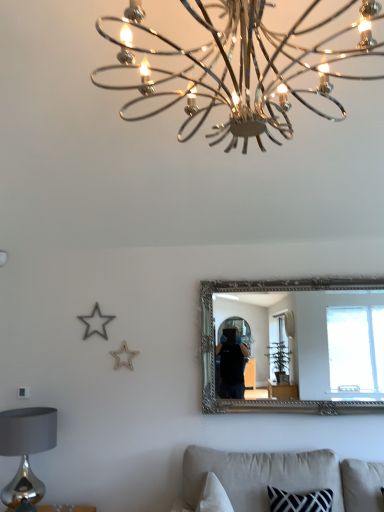
Question: Does silver ornate mirror at center touch shiny silver table lamp at lower left?

Choices:
 (A) yes
 (B) no

Answer: (B)

Question: Is silver ornate mirror at center bigger than shiny silver table lamp at lower left?

Choices:
 (A) no
 (B) yes

Answer: (B)

Question: From the image's perspective, is silver ornate mirror at center above shiny silver table lamp at lower left?

Choices:
 (A) no
 (B) yes

Answer: (B)

Question: Is silver ornate mirror at center taller than shiny silver table lamp at lower left?

Choices:
 (A) no
 (B) yes

Answer: (B)

Question: Is silver ornate mirror at center oriented away from shiny silver table lamp at lower left?

Choices:
 (A) no
 (B) yes

Answer: (A)

Question: In terms of height, does beige fabric couch at lower center look taller or shorter compared to silver ornate mirror at center?

Choices:
 (A) short
 (B) tall

Answer: (A)

Question: Is point (266, 458) closer or farther from the camera than point (360, 308)?

Choices:
 (A) farther
 (B) closer

Answer: (B)

Question: From a real-world perspective, is beige fabric couch at lower center physically located above or below silver ornate mirror at center?

Choices:
 (A) above
 (B) below

Answer: (B)

Question: Do you think beige fabric couch at lower center is within silver ornate mirror at center, or outside of it?

Choices:
 (A) inside
 (B) outside

Answer: (B)

Question: In the image, is silver ornate mirror at center on the left side or the right side of shiny silver table lamp at lower left?

Choices:
 (A) right
 (B) left

Answer: (A)

Question: Would you say silver ornate mirror at center is inside or outside shiny silver table lamp at lower left?

Choices:
 (A) inside
 (B) outside

Answer: (B)

Question: Considering the positions of silver ornate mirror at center and shiny silver table lamp at lower left in the image, is silver ornate mirror at center taller or shorter than shiny silver table lamp at lower left?

Choices:
 (A) short
 (B) tall

Answer: (B)

Question: From the image's perspective, relative to shiny silver table lamp at lower left, is silver ornate mirror at center above or below?

Choices:
 (A) below
 (B) above

Answer: (B)

Question: Does point (142, 72) appear closer or farther from the camera than point (28, 426)?

Choices:
 (A) closer
 (B) farther

Answer: (A)

Question: Based on their sizes in the image, would you say chrome/metallic chandelier at upper center is bigger or smaller than shiny silver table lamp at lower left?

Choices:
 (A) big
 (B) small

Answer: (A)